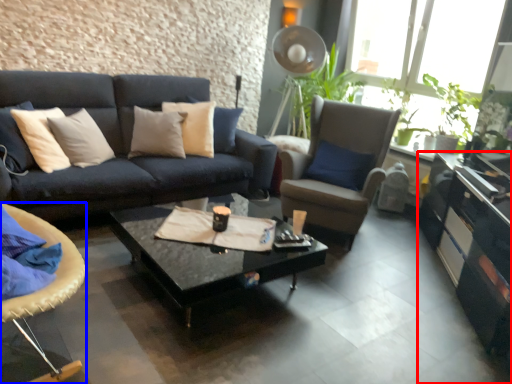
Question: Which object is further to the camera taking this photo, cabinetry (highlighted by a red box) or chair (highlighted by a blue box)?

Choices:
 (A) cabinetry
 (B) chair

Answer: (A)